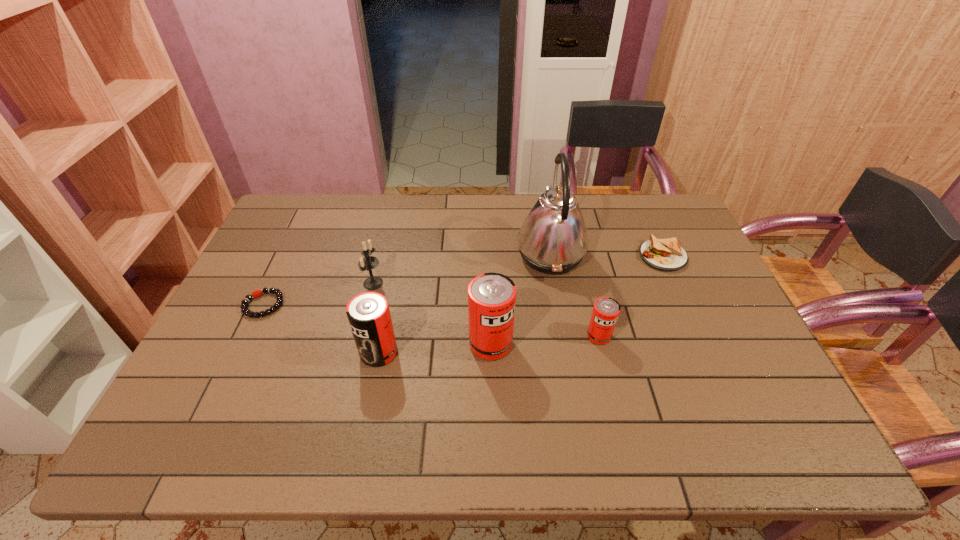
The height and width of the screenshot is (540, 960). Find the location of `vacant place for an extra can on the right`. vacant place for an extra can on the right is located at coordinates (704, 328).